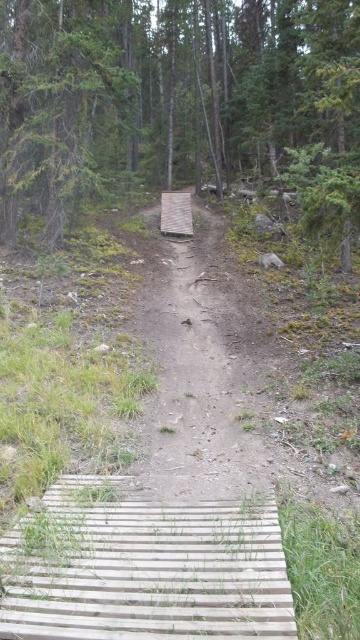
You are a hiker trying to cross the wooden bridge in the forest. You notice the green matte tree at upper center and the wooden plank at center. Which object is taller?

The green matte tree at upper center is taller than the wooden plank at center.

You are a hiker carrying a heavy backpack and need to cross the wooden bridge. You notice the green matte tree at upper left and the wooden plank at center. Which object is closer to you as you approach the bridge?

The green matte tree at upper left is closer to you because it is in front of the wooden plank at center, meaning it is positioned nearer to your viewpoint as you approach the bridge.

You are a hiker carrying a 15 feet long ladder. You want to cross the wooden bridge on the trail. The bridge has two points marked as point A at coordinate point (333,96) and point B at coordinate point 0.850, 0.075. Can the ladder fit diagonally from point A to point B on the bridge?

The distance between point A at coordinate point (333,96) and point B at coordinate point 0.850, 0.075 is 14.74 feet, which is shorter than the ladder length of 15 feet. Therefore, the ladder can fit diagonally on the bridge between these two points.